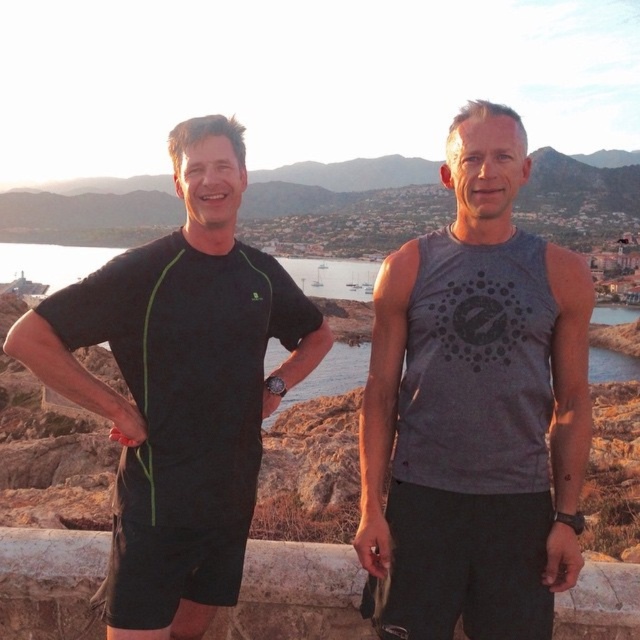
Question: Can you confirm if gray matte tank top at center is positioned to the right of stone at center?

Choices:
 (A) no
 (B) yes

Answer: (B)

Question: Based on their relative distances, which object is farther from the gray matte tank top at center?

Choices:
 (A) stone at center
 (B) black matte t-shirt at left

Answer: (B)

Question: Which object is positioned farthest from the stone at center?

Choices:
 (A) black matte t-shirt at left
 (B) gray matte tank top at center

Answer: (B)

Question: Which object appears farthest from the camera in this image?

Choices:
 (A) gray matte tank top at center
 (B) stone at center

Answer: (B)

Question: Is gray matte tank top at center below stone at center?

Choices:
 (A) yes
 (B) no

Answer: (B)

Question: Is gray matte tank top at center above stone at center?

Choices:
 (A) yes
 (B) no

Answer: (A)